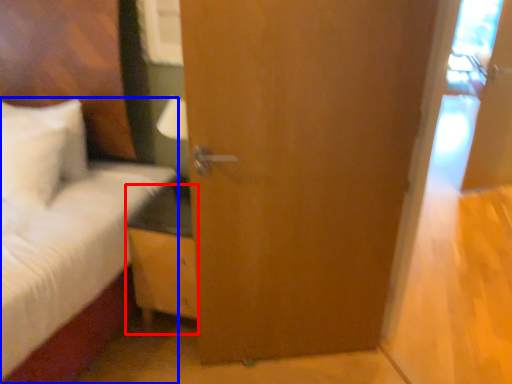
Question: Which of the following is the closest to the observer, nightstand (highlighted by a red box) or bed (highlighted by a blue box)?

Choices:
 (A) nightstand
 (B) bed

Answer: (B)